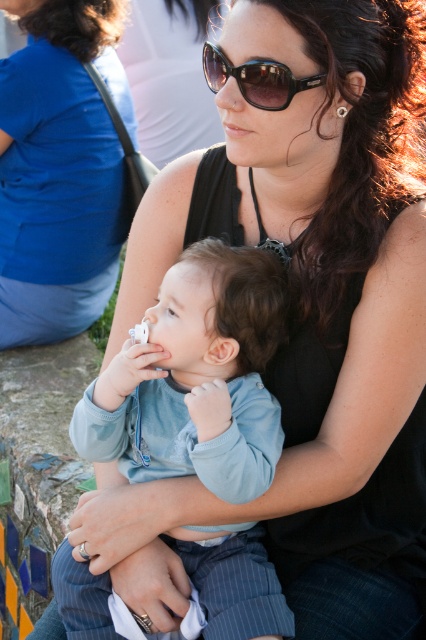
You are a photographer trying to capture a closeup shot of the woman and baby. You have a camera with a lens that can focus on objects within a 30 cm width. The matte black tank top at center and brown glossy sunglasses at upper center are both in your frame. Can your camera focus on both objects simultaneously?

The matte black tank top at center might be wider than brown glossy sunglasses at upper center, so the total width of both objects could exceed the camera lens focus range of 30 cm. Therefore, it is uncertain if both can be focused on at the same time.

You are a photographer trying to capture a closeup shot of the baby in the image. You notice the light blue fabric pacifier at center and the matte black tank top at center. Which object should you focus on if you want to ensure the smaller one is in sharp focus?

The light blue fabric pacifier at center is smaller than the matte black tank top at center, so you should focus on the light blue fabric pacifier at center to ensure it is in sharp focus.